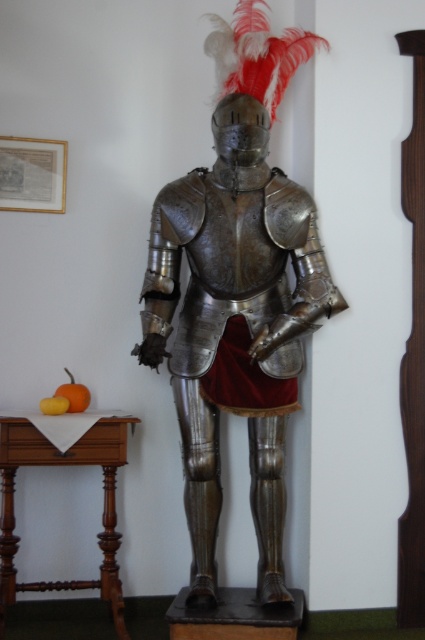
Does shiny metallic armor at center appear on the left side of wooden table at lower left?

Incorrect, shiny metallic armor at center is not on the left side of wooden table at lower left.

Is point (266, 342) more distant than point (31, 460)?

Yes.

The height and width of the screenshot is (640, 425). Identify the location of shiny metallic armor at center. (237, 292).